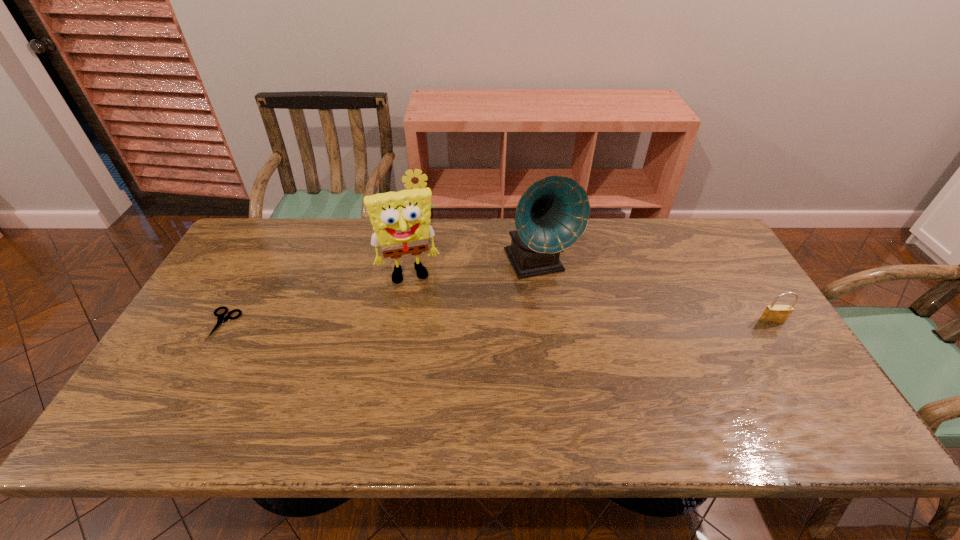
Identify the location of blank region between the fourth shortest object and the phonograph_record. (474, 269).

The image size is (960, 540). In order to click on empty space between the shears and the second object from right to left in this screenshot , I will do `click(381, 294)`.

Where is `free spot between the third tallest object and the shortest object`? Image resolution: width=960 pixels, height=540 pixels. free spot between the third tallest object and the shortest object is located at coordinates (323, 275).

Identify the location of vacant space in between the phonograph_record and the farthest object. The height and width of the screenshot is (540, 960). (480, 245).

Identify the location of empty location between the fourth shortest object and the second object from right to left. The height and width of the screenshot is (540, 960). (474, 269).

Identify the location of vacant space that is in between the sunflower and the rightmost object. (596, 273).

Locate an element on the screen. This screenshot has height=540, width=960. vacant area between the farthest object and the shears is located at coordinates (323, 275).

Where is `empty space between the fourth object from left to right and the sunflower`? empty space between the fourth object from left to right and the sunflower is located at coordinates (480, 245).

Where is `vacant area that lies between the sponge and the second shortest object`? This screenshot has width=960, height=540. vacant area that lies between the sponge and the second shortest object is located at coordinates (589, 298).

I want to click on object that is the closest to the farthest object, so click(x=401, y=220).